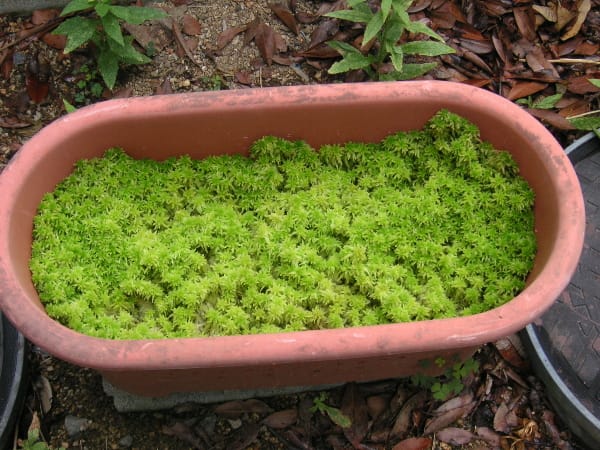
Where is `ceramic pot`? This screenshot has width=600, height=450. ceramic pot is located at coordinates pos(385,350).